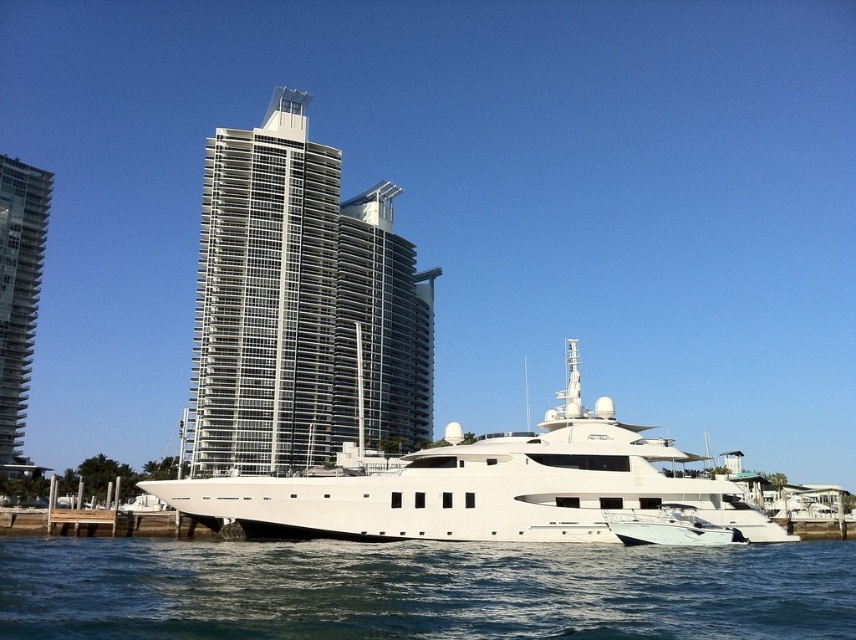
You are standing on the deck of the yacht and looking towards the skyline. Which skyscraper is closer to you, the silver glass skyscraper at center or the glassy steel skyscraper at left?

The silver glass skyscraper at center is closer to you because it is positioned in front of the glassy steel skyscraper at left.

You are standing on the deck of the yacht and looking out. There is a point marked at coordinates (421,589). What is located at that point?

The point at coordinates (421,589) marks clear blue water at lower center.